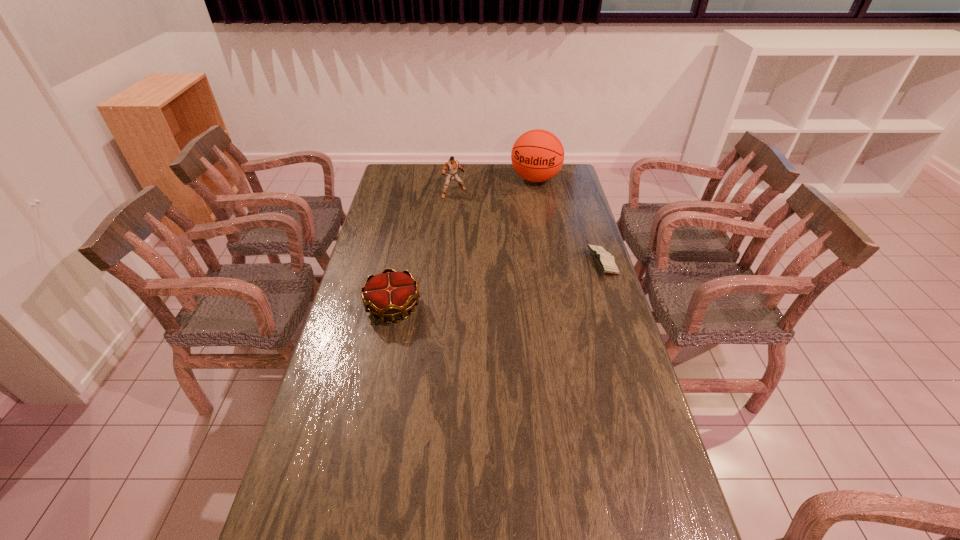
Where is `empty location between the second nearest object and the second object from right to left`? empty location between the second nearest object and the second object from right to left is located at coordinates (568, 221).

I want to click on unoccupied area between the nearest object and the diary, so click(x=497, y=285).

Locate an element on the screen. free space that is in between the nearest object and the second object from right to left is located at coordinates (465, 243).

This screenshot has height=540, width=960. I want to click on free space between the nearest object and the second object from left to right, so click(423, 250).

Identify the location of empty location between the tallest object and the puncher. (494, 186).

You are a GUI agent. You are given a task and a screenshot of the screen. Output one action in this format:
    pyautogui.click(x=<x>, y=<y>)
    Task: Click on the free space between the tallest object and the rightmost object
    The width and height of the screenshot is (960, 540).
    Given the screenshot: What is the action you would take?
    pyautogui.click(x=568, y=221)

The image size is (960, 540). Identify the location of object that is the second closest to the second object from left to right. (387, 295).

The height and width of the screenshot is (540, 960). I want to click on object identified as the third closest to the diary, so pos(387,295).

This screenshot has width=960, height=540. I want to click on vacant space that satisfies the following two spatial constraints: 1. on the back side of the shortest object; 2. on the right side of the crown, so click(x=402, y=262).

Find the location of a particular element. free spot that satisfies the following two spatial constraints: 1. on the back side of the puncher; 2. on the right side of the second object from right to left is located at coordinates (455, 179).